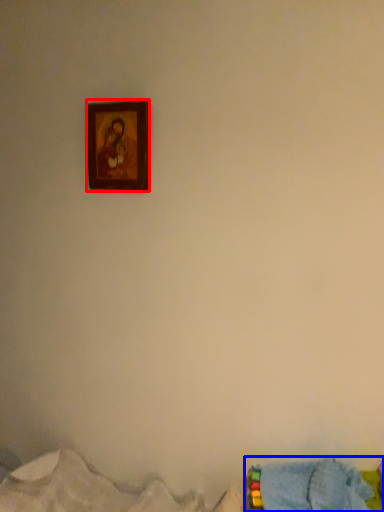
Question: Which of the following is the farthest to the observer, picture frame (highlighted by a red box) or bed (highlighted by a blue box)?

Choices:
 (A) picture frame
 (B) bed

Answer: (A)